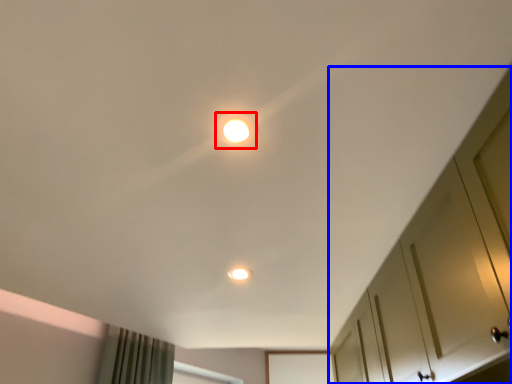
Question: Which object appears farthest to the camera in this image, dot (highlighted by a red box) or dresser (highlighted by a blue box)?

Choices:
 (A) dot
 (B) dresser

Answer: (A)